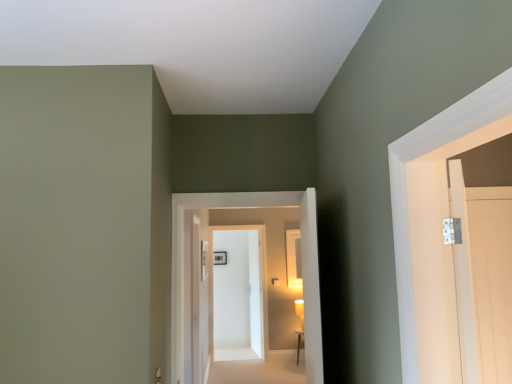
Question: Is white glossy door at center, placed as the 3th door when sorted from front to back, at the left side of white glossy door at center, which appears as the 3th door when viewed from the left?

Choices:
 (A) yes
 (B) no

Answer: (A)

Question: Is white glossy door at center, the fourth door from the right, facing away from white glossy door at center, arranged as the second door when viewed from the right?

Choices:
 (A) no
 (B) yes

Answer: (A)

Question: Is white glossy door at center, which ranks as the 1th door in left-to-right order, further to camera compared to white glossy door at center, which is the fourth door in back-to-front order?

Choices:
 (A) yes
 (B) no

Answer: (A)

Question: Can you confirm if white glossy door at center, placed as the 3th door when sorted from front to back, is thinner than white glossy door at center, which is the 1th door from front to back?

Choices:
 (A) no
 (B) yes

Answer: (B)

Question: Considering the relative positions of white glossy door at center, the fourth door from the right, and white glossy door at center, arranged as the second door when viewed from the right, in the image provided, is white glossy door at center, the fourth door from the right, to the right of white glossy door at center, arranged as the second door when viewed from the right, from the viewer's perspective?

Choices:
 (A) yes
 (B) no

Answer: (B)

Question: From a real-world perspective, is white glossy door at center, placed as the 3th door when sorted from front to back, physically below white glossy door at center, which is the fourth door in back-to-front order?

Choices:
 (A) yes
 (B) no

Answer: (A)

Question: Is matte gold wall sconce at center to the left of smooth beige carpet at center from the viewer's perspective?

Choices:
 (A) yes
 (B) no

Answer: (B)

Question: From a real-world perspective, is matte gold wall sconce at center physically above smooth beige carpet at center?

Choices:
 (A) yes
 (B) no

Answer: (A)

Question: Does matte gold wall sconce at center have a lesser width compared to smooth beige carpet at center?

Choices:
 (A) yes
 (B) no

Answer: (A)

Question: Is matte gold wall sconce at center completely or partially outside of smooth beige carpet at center?

Choices:
 (A) yes
 (B) no

Answer: (A)

Question: Does matte gold wall sconce at center have a smaller size compared to smooth beige carpet at center?

Choices:
 (A) yes
 (B) no

Answer: (A)

Question: Can you see matte gold wall sconce at center touching smooth beige carpet at center?

Choices:
 (A) yes
 (B) no

Answer: (B)

Question: From the image's perspective, would you say light wood door at right, the fourth door when ordered from left to right, is shown under white glossy door at center, arranged as the 2th door when viewed from the back?

Choices:
 (A) no
 (B) yes

Answer: (A)